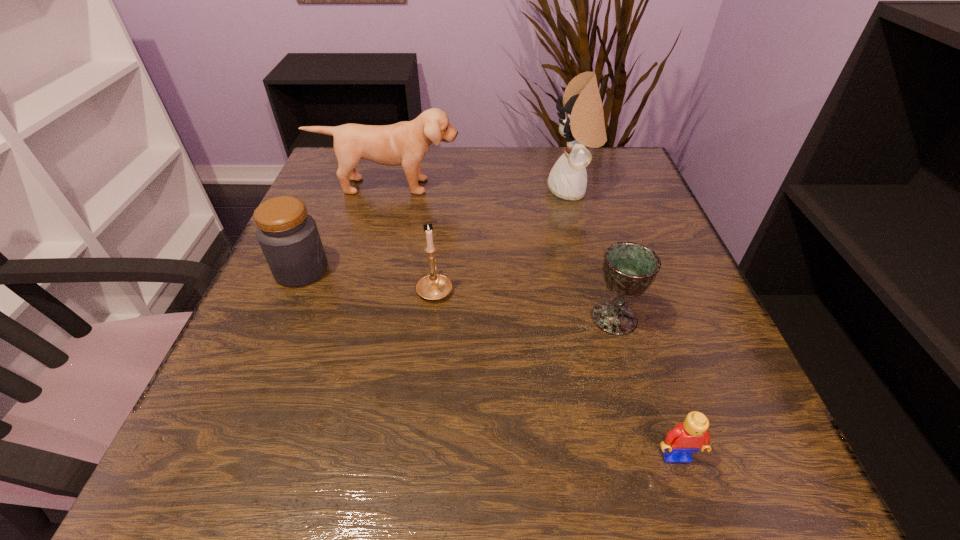
In the image, there is a desktop. Where is `vacant space at the right edge`? This screenshot has height=540, width=960. vacant space at the right edge is located at coordinates (645, 200).

In the image, there is a desktop. Where is `free space at the near left corner`? Image resolution: width=960 pixels, height=540 pixels. free space at the near left corner is located at coordinates (230, 456).

This screenshot has width=960, height=540. What are the coordinates of `vacant space at the far right corner` in the screenshot? It's located at (618, 180).

Identify the location of free space that is in between the jar and the chalice. (458, 294).

Locate an element on the screen. The image size is (960, 540). blank region between the candle holder and the chalice is located at coordinates click(x=524, y=303).

Image resolution: width=960 pixels, height=540 pixels. What are the coordinates of `vacant area that lies between the jar and the doll` in the screenshot? It's located at (437, 231).

Identify the location of vacant area that lies between the fifth shortest object and the chalice. This screenshot has width=960, height=540. (501, 252).

This screenshot has width=960, height=540. I want to click on free space between the puppy and the tallest object, so (x=480, y=188).

Find the location of a particular element. This screenshot has width=960, height=540. free spot between the tallest object and the jar is located at coordinates (437, 231).

Identify the location of free space between the Lego and the jar. (489, 363).